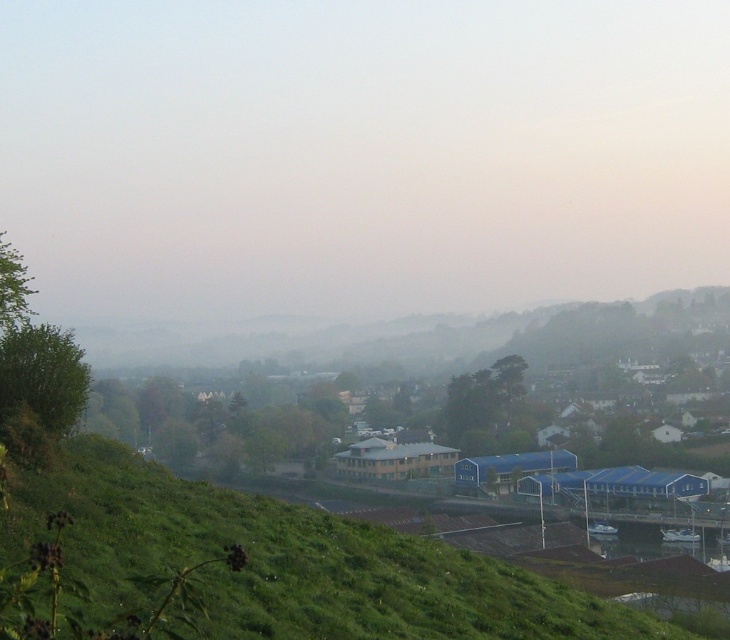
Is foggy haze at center below green grassy hillside at lower center?

Incorrect, foggy haze at center is not positioned below green grassy hillside at lower center.

Does foggy haze at center have a lesser width compared to green grassy hillside at lower center?

No.

Who is more distant from viewer, (283, 124) or (231, 540)?

The point (283, 124) is behind.

Locate an element on the screen. The width and height of the screenshot is (730, 640). foggy haze at center is located at coordinates (356, 163).